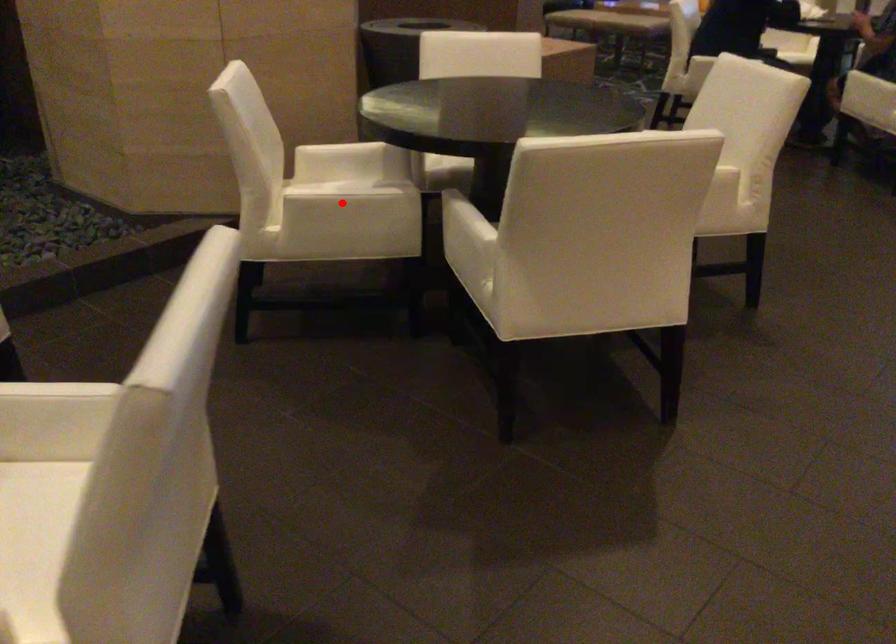
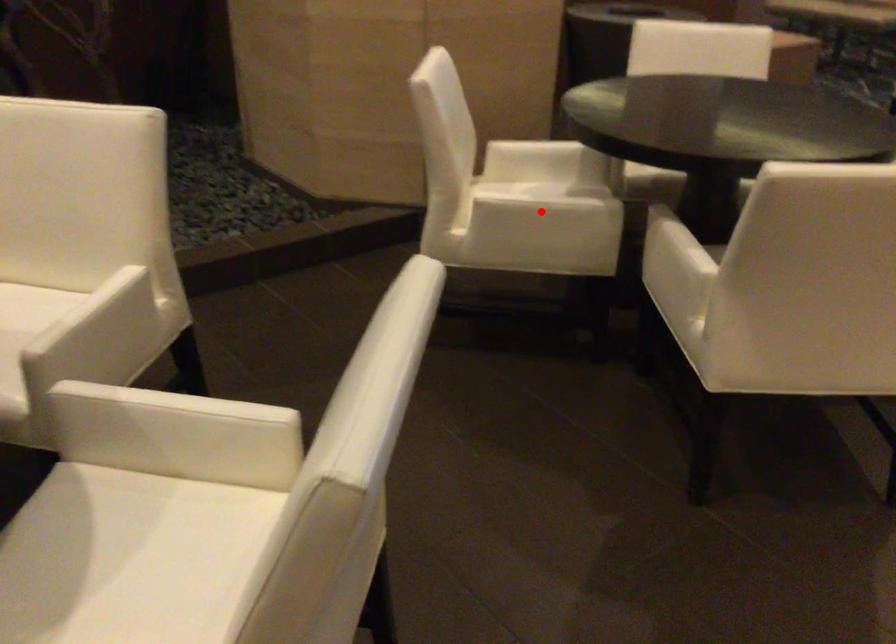
I am providing you with two images of the same scene from different viewpoints. A red point is marked on the first image and another point is marked on the second image. Is the red point in image1 aligned with the point shown in image2?

Yes